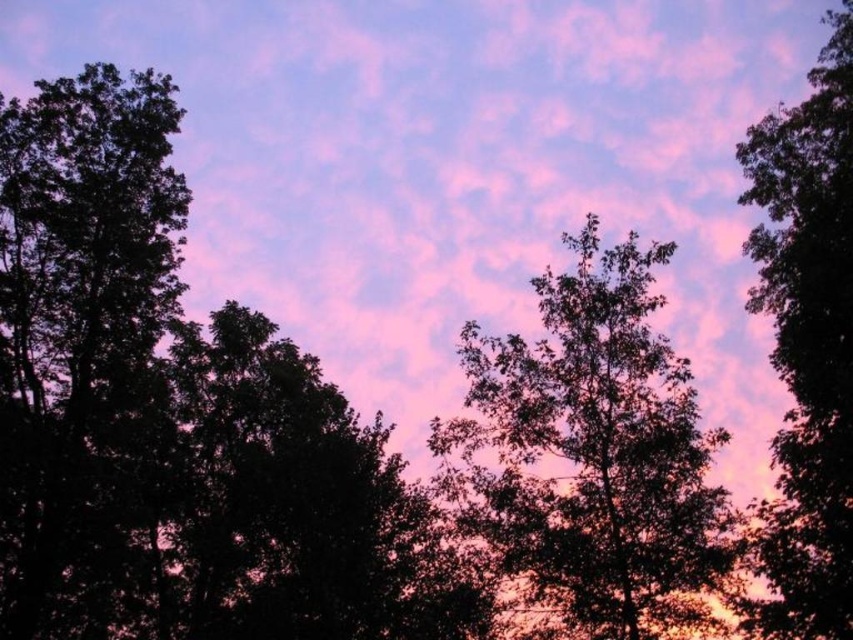
Question: Can you confirm if green leafy tree at center is smaller than silhouette leafy tree at right?

Choices:
 (A) yes
 (B) no

Answer: (A)

Question: Is green leafy tree at center below silhouette leafy tree at right?

Choices:
 (A) yes
 (B) no

Answer: (A)

Question: Which point is closer to the camera?

Choices:
 (A) silhouette leafy tree at right
 (B) green leafy tree at center

Answer: (A)

Question: Which point is closer to the camera?

Choices:
 (A) silhouette leafy tree at right
 (B) green leafy tree at center

Answer: (A)

Question: In this image, where is green leafy tree at center located relative to silhouette leafy tree at right?

Choices:
 (A) above
 (B) below

Answer: (B)